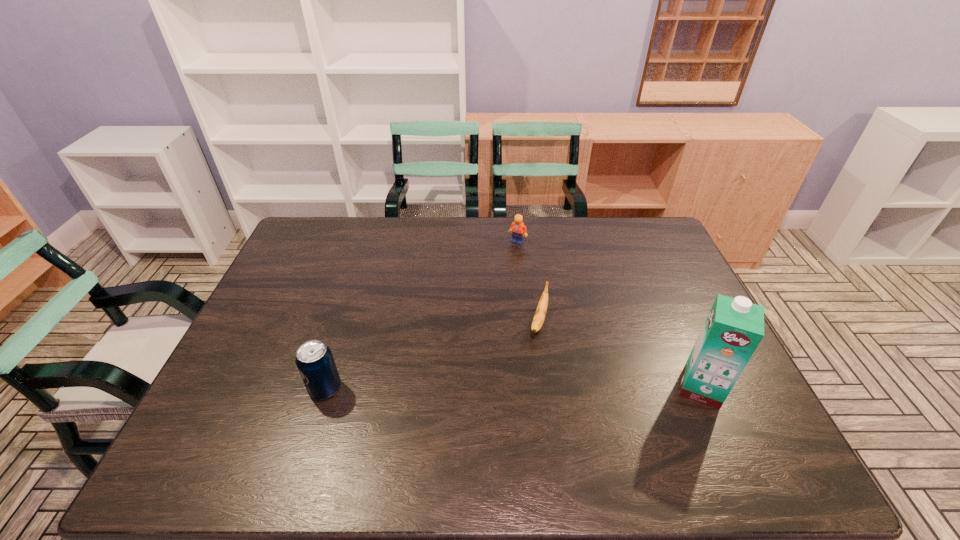
Find the location of `free space located on the front-facing side of the third tallest object`. free space located on the front-facing side of the third tallest object is located at coordinates tap(511, 281).

Image resolution: width=960 pixels, height=540 pixels. I want to click on free space located on the front-facing side of the third tallest object, so (505, 315).

This screenshot has height=540, width=960. Find the location of `vacant space situated on the front-facing side of the third tallest object`. vacant space situated on the front-facing side of the third tallest object is located at coordinates (513, 265).

The image size is (960, 540). What are the coordinates of `vacant region located on the peel of the banana from the top` in the screenshot? It's located at (514, 427).

Locate an element on the screen. The image size is (960, 540). free location located on the peel of the banana from the top is located at coordinates (516, 419).

Find the location of a particular element. Image resolution: width=960 pixels, height=540 pixels. vacant point located on the peel of the banana from the top is located at coordinates [530, 369].

Find the location of a particular element. Image resolution: width=960 pixels, height=540 pixels. object present at the far edge is located at coordinates (518, 229).

Locate an element on the screen. The image size is (960, 540). soda can present at the near edge is located at coordinates (314, 360).

You are a GUI agent. You are given a task and a screenshot of the screen. Output one action in this format:
    pyautogui.click(x=<x>, y=<y>)
    Task: Click on the carton situated at the near edge
    This screenshot has width=960, height=540.
    Given the screenshot: What is the action you would take?
    pyautogui.click(x=734, y=327)

At what (x,y) coordinates should I click in order to perform the action: click on object present at the right edge. Please return your answer as a coordinate pair (x, y). The height and width of the screenshot is (540, 960). Looking at the image, I should click on (734, 327).